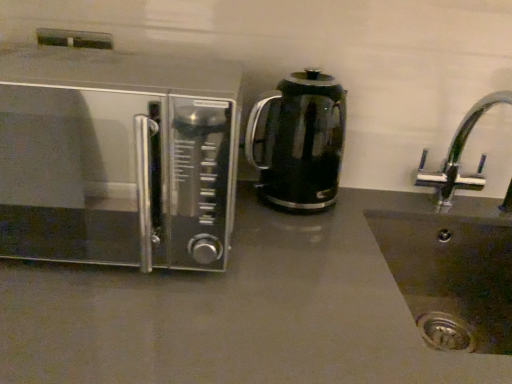
Question: Is chrome metallic faucet at right taller or shorter than black glass kettle at center?

Choices:
 (A) short
 (B) tall

Answer: (B)

Question: Is point (472, 114) closer or farther from the camera than point (340, 112)?

Choices:
 (A) closer
 (B) farther

Answer: (B)

Question: Based on their relative distances, which object is nearer to the matte gray countertop at center?

Choices:
 (A) satin silver microwave at left
 (B) black glass kettle at center
 (C) chrome metallic faucet at right

Answer: (A)

Question: Which of these objects is positioned closest to the matte gray countertop at center?

Choices:
 (A) chrome metallic faucet at right
 (B) black glass kettle at center
 (C) satin silver microwave at left

Answer: (C)